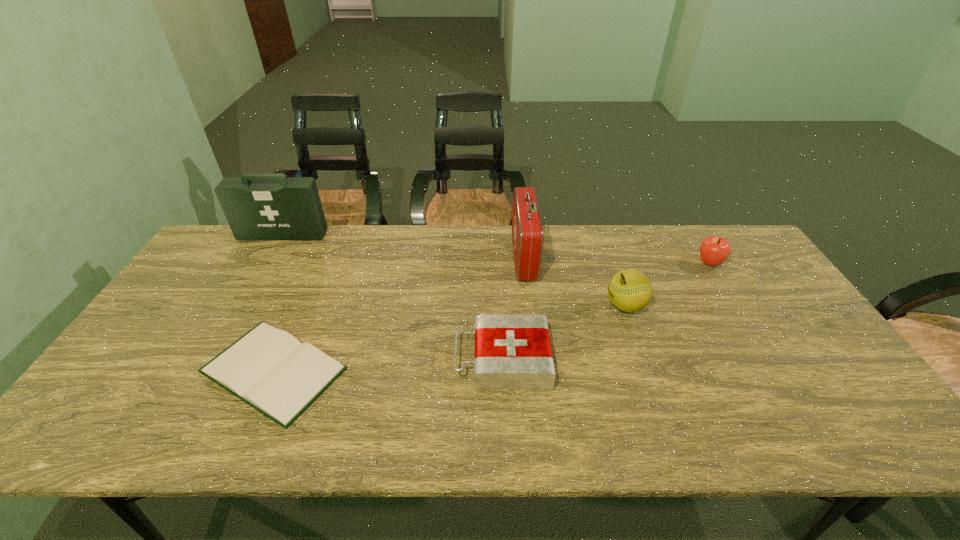
Locate an element on the screen. Image resolution: width=960 pixels, height=540 pixels. object that is at the far left corner is located at coordinates (258, 206).

Where is `object at the far right corner`? This screenshot has height=540, width=960. object at the far right corner is located at coordinates (714, 250).

The height and width of the screenshot is (540, 960). I want to click on free space at the far edge of the desktop, so click(x=596, y=260).

Locate an element on the screen. Image resolution: width=960 pixels, height=540 pixels. vacant space at the near edge of the desktop is located at coordinates (534, 420).

In the image, there is a desktop. At what (x,y) coordinates should I click in order to perform the action: click on free space at the left edge. Please return your answer as a coordinate pair (x, y). This screenshot has width=960, height=540. Looking at the image, I should click on (236, 271).

This screenshot has height=540, width=960. In the image, there is a desktop. Identify the location of free region at the right edge. (841, 367).

Where is `vacant space at the far right corner`? vacant space at the far right corner is located at coordinates click(x=739, y=252).

The image size is (960, 540). I want to click on vacant space that is in between the apple and the leftmost first-aid kit, so click(x=496, y=249).

Identify the location of vacant area that lies between the second shortest object and the softball. (564, 332).

You are a GUI agent. You are given a task and a screenshot of the screen. Output one action in this format:
    pyautogui.click(x=<x>, y=<y>)
    Task: Click on the vacant region between the rightmost object and the fifth tallest object
    The image size is (960, 540).
    Given the screenshot: What is the action you would take?
    pyautogui.click(x=606, y=311)